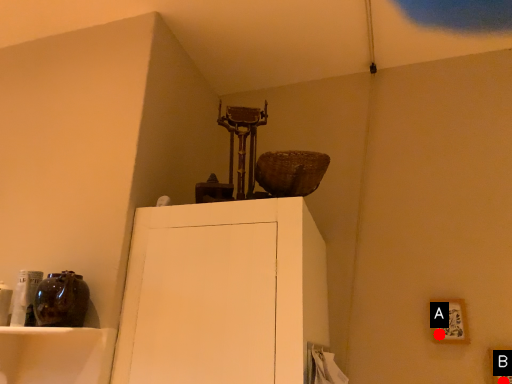
Question: Two points are circled on the image, labeled by A and B beside each circle. Which point is closer to the camera?

Choices:
 (A) A is closer
 (B) B is closer

Answer: (B)